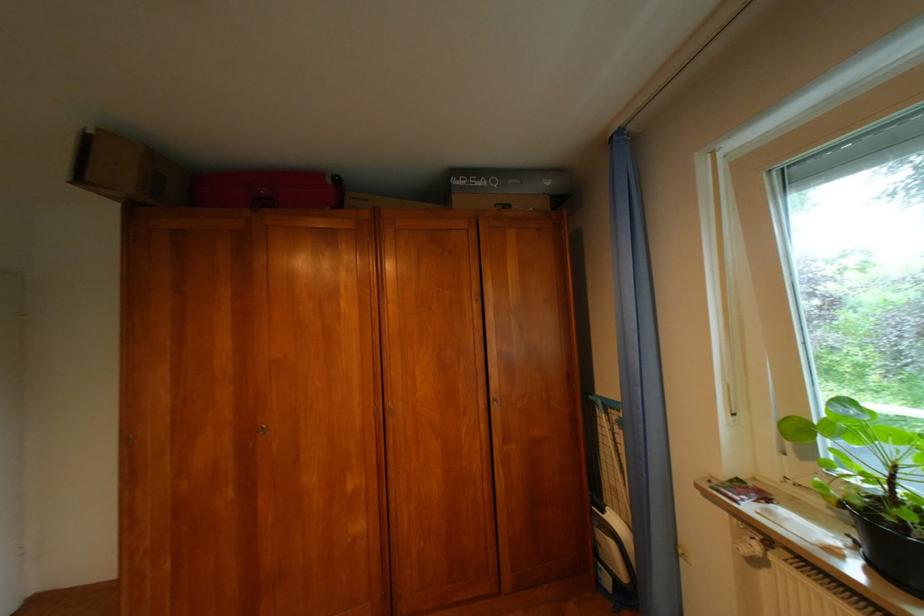
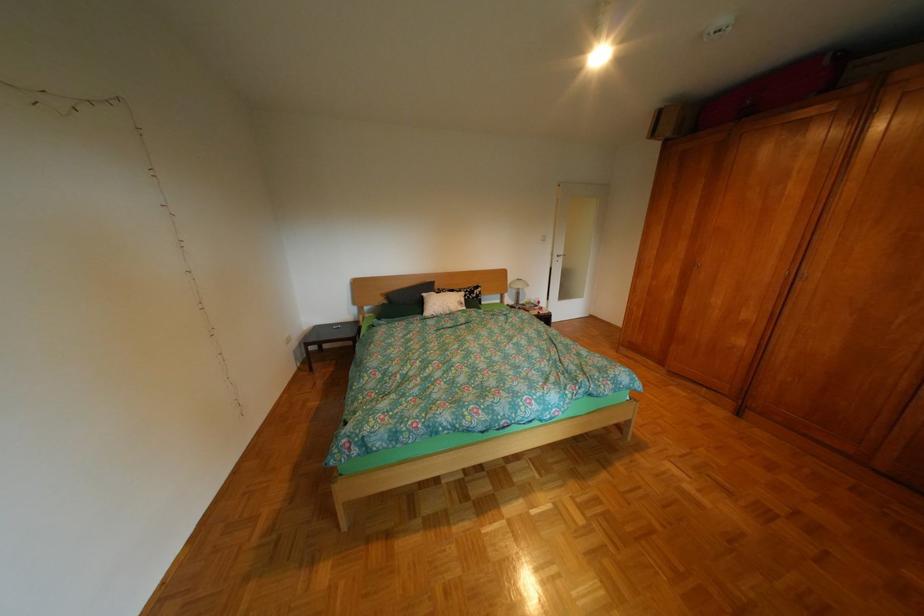
Where in the second image is the point corresponding to (403,405) from the first image?

(819, 273)